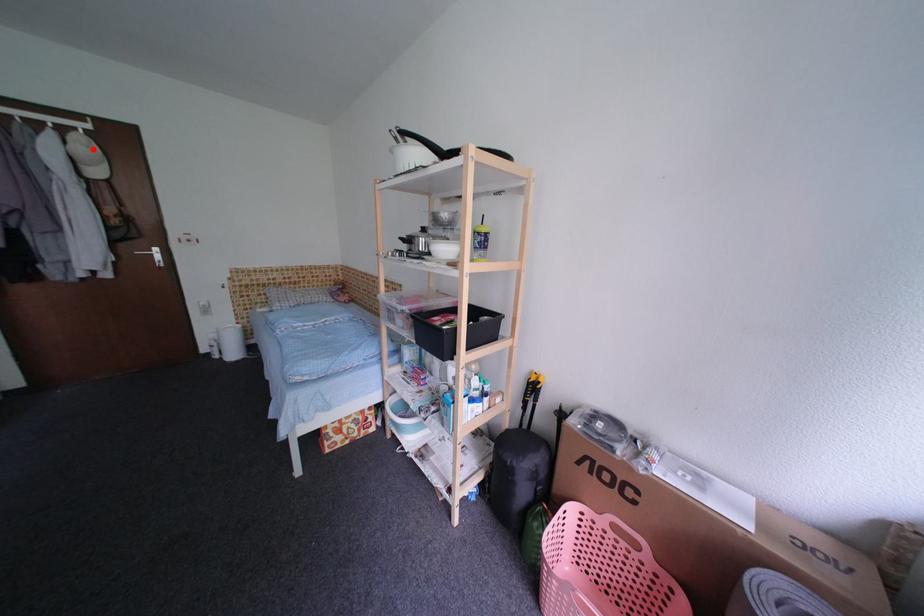
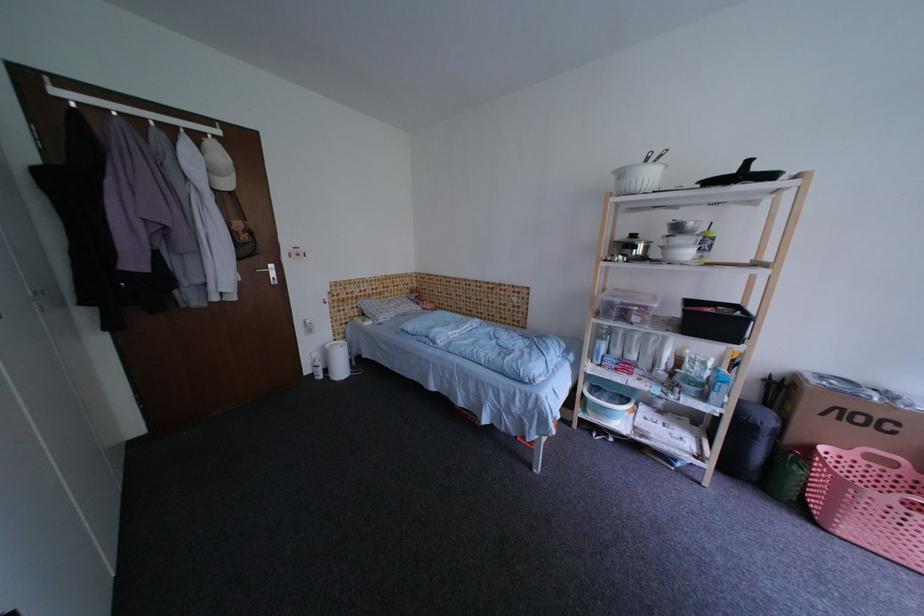
Question: A red point is marked in image1. In image2, is the corresponding 3D point closer to the camera or farther? Reply with the corresponding letter.

Choices:
 (A) The corresponding 3D point is closer.
 (B) The corresponding 3D point is farther.

Answer: (A)